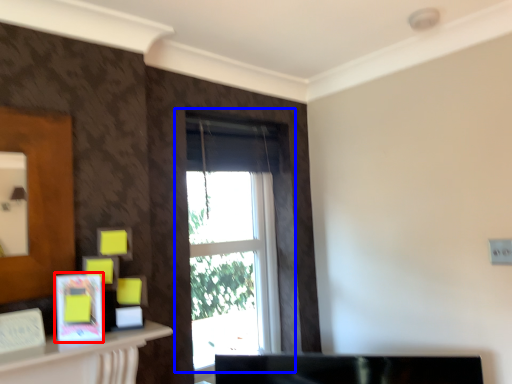
Question: Which of the following is the closest to the observer, picture frame (highlighted by a red box) or window (highlighted by a blue box)?

Choices:
 (A) picture frame
 (B) window

Answer: (A)